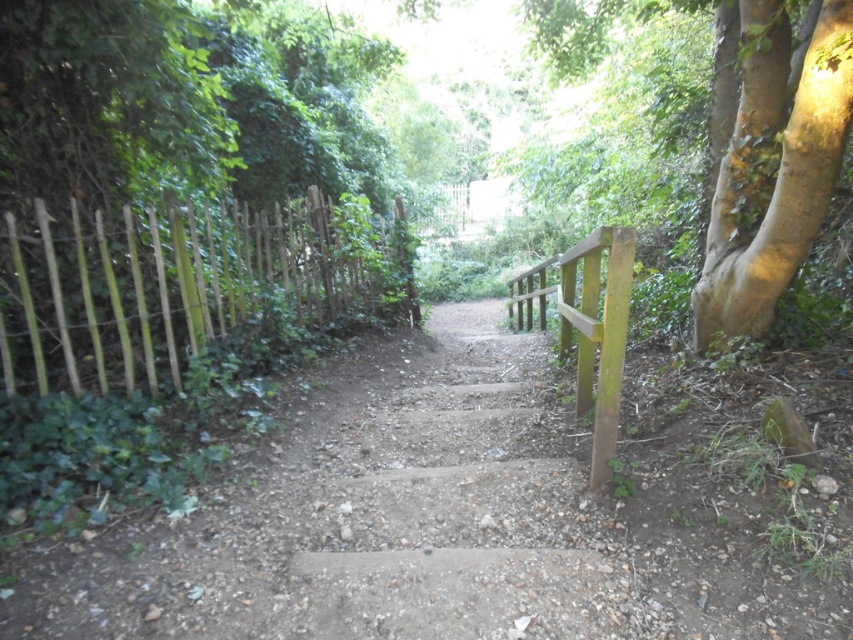
Question: Is wooden picket fence at left thinner than green wood rail at right?

Choices:
 (A) no
 (B) yes

Answer: (A)

Question: Which is farther from the green wood rail at right?

Choices:
 (A) green rough bark tree at right
 (B) wooden picket fence at left

Answer: (B)

Question: Can you confirm if wooden picket fence at left is wider than green rough bark tree at right?

Choices:
 (A) no
 (B) yes

Answer: (B)

Question: Which of the following is the farthest from the observer?

Choices:
 (A) (621, 304)
 (B) (306, 236)
 (C) (744, 312)

Answer: (B)

Question: Is wooden picket fence at left positioned at the back of green wood rail at right?

Choices:
 (A) yes
 (B) no

Answer: (A)

Question: Which of the following is the farthest from the observer?

Choices:
 (A) (144, 307)
 (B) (753, 307)

Answer: (A)